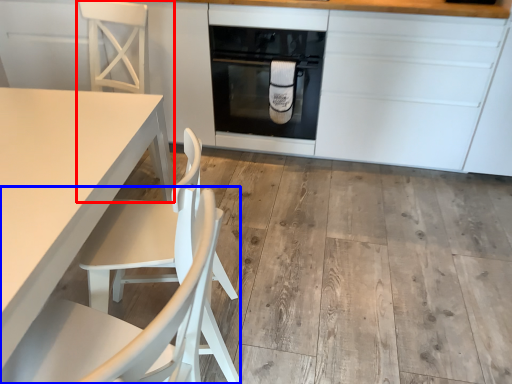
Question: Which point is further to the camera, chair (highlighted by a red box) or chair (highlighted by a blue box)?

Choices:
 (A) chair
 (B) chair

Answer: (A)